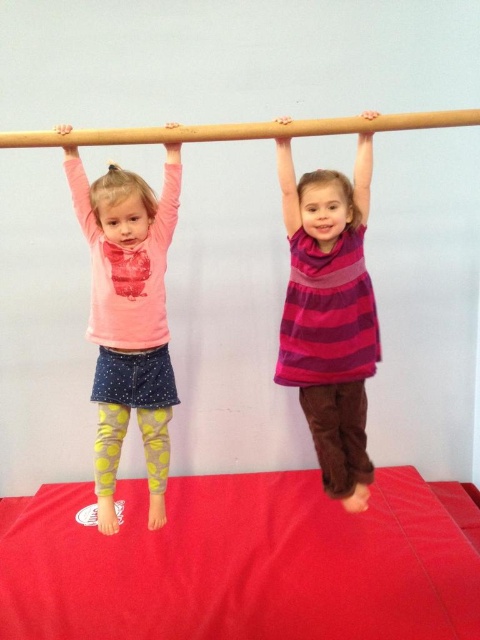
You are a photographer standing in front of the two children. You want to take a photo of the purple striped dress at center and the pink matte shirt at left. Which child should you focus on first to ensure both are in focus?

You should focus on the pink matte shirt at left first because it is farther away from the photographer than the purple striped dress at center, ensuring both will be in focus when focusing on the farther object.